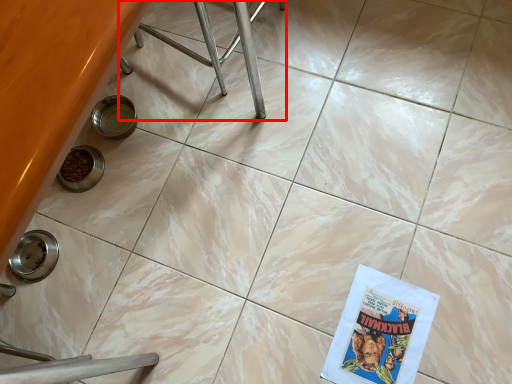
Question: Observing the image, what is the correct spatial positioning of furniture (annotated by the red box) in reference to comic book?

Choices:
 (A) left
 (B) right

Answer: (A)